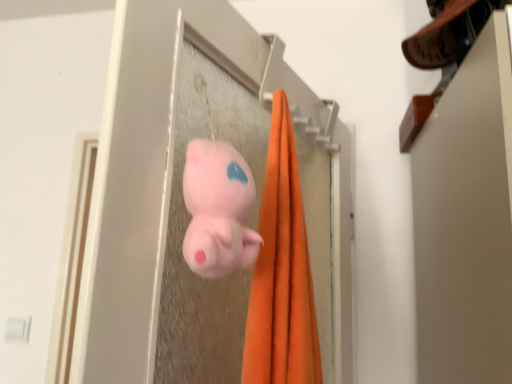
Find the location of a particular element. The width and height of the screenshot is (512, 384). fluffy pink plush at center is located at coordinates (218, 209).

In order to face fluffy pink plush at center, should I rotate leftwards or rightwards?

You should look left and rotate roughly 4.798 degrees.

What do you see at coordinates (218, 209) in the screenshot?
I see `fluffy pink plush at center` at bounding box center [218, 209].

In the scene shown: What is the approximate width of fluffy pink plush at center?

The width of fluffy pink plush at center is 3.29 inches.

Where is `pink plush toy at center`? The image size is (512, 384). pink plush toy at center is located at coordinates (252, 217).

What do you see at coordinates (252, 217) in the screenshot? The image size is (512, 384). I see `pink plush toy at center` at bounding box center [252, 217].

Where is `fluffy pink plush at center`? Image resolution: width=512 pixels, height=384 pixels. fluffy pink plush at center is located at coordinates (218, 209).

Is fluffy pink plush at center to the left or to the right of pink plush toy at center in the image?

In the image, fluffy pink plush at center appears on the left side of pink plush toy at center.

Considering the relative positions of fluffy pink plush at center and pink plush toy at center in the image provided, is fluffy pink plush at center behind pink plush toy at center?

That is False.

Is point (212, 250) farther from camera compared to point (344, 272)?

No, (212, 250) is in front of (344, 272).

From the image's perspective, relative to pink plush toy at center, is fluffy pink plush at center above or below?

fluffy pink plush at center is below pink plush toy at center.

Consider the image. From a real-world perspective, which is physically below, fluffy pink plush at center or pink plush toy at center?

fluffy pink plush at center is physically lower.

Which of these two, fluffy pink plush at center or pink plush toy at center, is wider?

pink plush toy at center.

Between fluffy pink plush at center and pink plush toy at center, which one has more height?

pink plush toy at center.

Does fluffy pink plush at center have a larger size compared to pink plush toy at center?

No.

Is fluffy pink plush at center situated inside pink plush toy at center or outside?

fluffy pink plush at center is outside pink plush toy at center.

Is fluffy pink plush at center with pink plush toy at center?

No, fluffy pink plush at center is not next to pink plush toy at center.

Could you tell me if fluffy pink plush at center is turned towards pink plush toy at center?

No, fluffy pink plush at center is not oriented towards pink plush toy at center.

Can you tell me how much fluffy pink plush at center and pink plush toy at center differ in facing direction?

The facing directions of fluffy pink plush at center and pink plush toy at center are 0.00202 degrees apart.

How far apart are fluffy pink plush at center and pink plush toy at center?

fluffy pink plush at center is 9.98 inches from pink plush toy at center.

Locate an element on the screen. toy that is under the pink plush toy at center (from a real-world perspective) is located at coordinates (218, 209).

Is pink plush toy at center to the left or to the right of fluffy pink plush at center in the image?

Clearly, pink plush toy at center is on the right of fluffy pink plush at center in the image.

Is pink plush toy at center positioned in front of fluffy pink plush at center?

No, pink plush toy at center is further to the viewer.

Does point (318, 233) appear closer or farther from the camera than point (183, 175)?

Point (318, 233).

From the image's perspective, would you say pink plush toy at center is shown under fluffy pink plush at center?

Actually, pink plush toy at center appears above fluffy pink plush at center in the image.

From a real-world perspective, which is physically above, pink plush toy at center or fluffy pink plush at center?

pink plush toy at center, from a real-world perspective.

Based on the photo, considering the sizes of pink plush toy at center and fluffy pink plush at center in the image, is pink plush toy at center wider or thinner than fluffy pink plush at center?

Considering their sizes, pink plush toy at center looks broader than fluffy pink plush at center.

Which of these two, pink plush toy at center or fluffy pink plush at center, stands taller?

With more height is pink plush toy at center.

In the scene shown: Considering the sizes of objects pink plush toy at center and fluffy pink plush at center in the image provided, who is smaller, pink plush toy at center or fluffy pink plush at center?

fluffy pink plush at center is smaller.

Is pink plush toy at center inside the boundaries of fluffy pink plush at center, or outside?

pink plush toy at center is outside fluffy pink plush at center.

Is there a large distance between pink plush toy at center and fluffy pink plush at center?

pink plush toy at center is actually quite close to fluffy pink plush at center.

Could you tell me if pink plush toy at center is facing fluffy pink plush at center?

No, pink plush toy at center is not aimed at fluffy pink plush at center.

Can you tell me how much pink plush toy at center and fluffy pink plush at center differ in facing direction?

pink plush toy at center and fluffy pink plush at center are facing 0.00202 degrees away from each other.

What are the coordinates of `screen door that is above the fluffy pink plush at center (from a real-world perspective)` in the screenshot? It's located at (252, 217).

The height and width of the screenshot is (384, 512). What are the coordinates of `screen door located above the fluffy pink plush at center (from a real-world perspective)` in the screenshot? It's located at (252, 217).

Locate an element on the screen. This screenshot has width=512, height=384. screen door behind the fluffy pink plush at center is located at coordinates (252, 217).